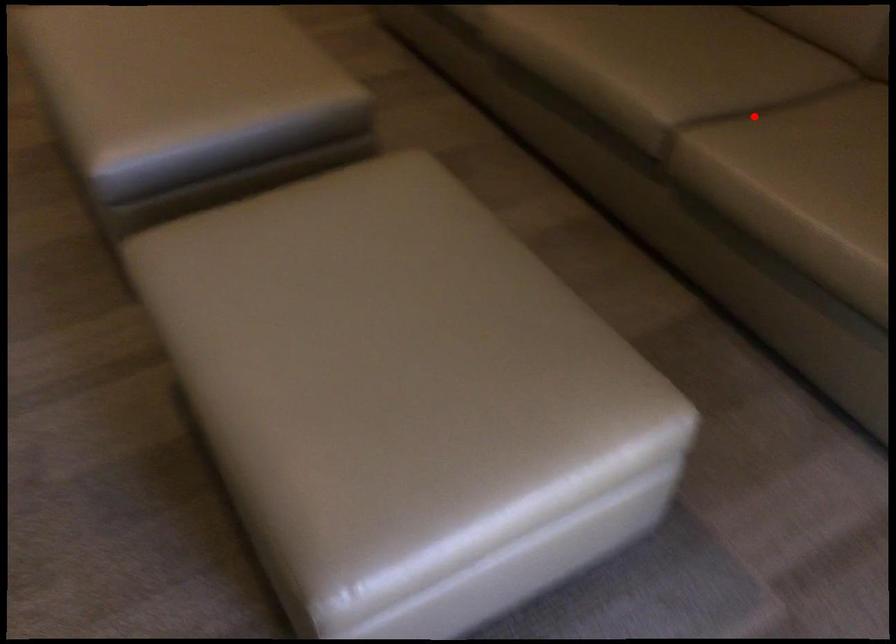
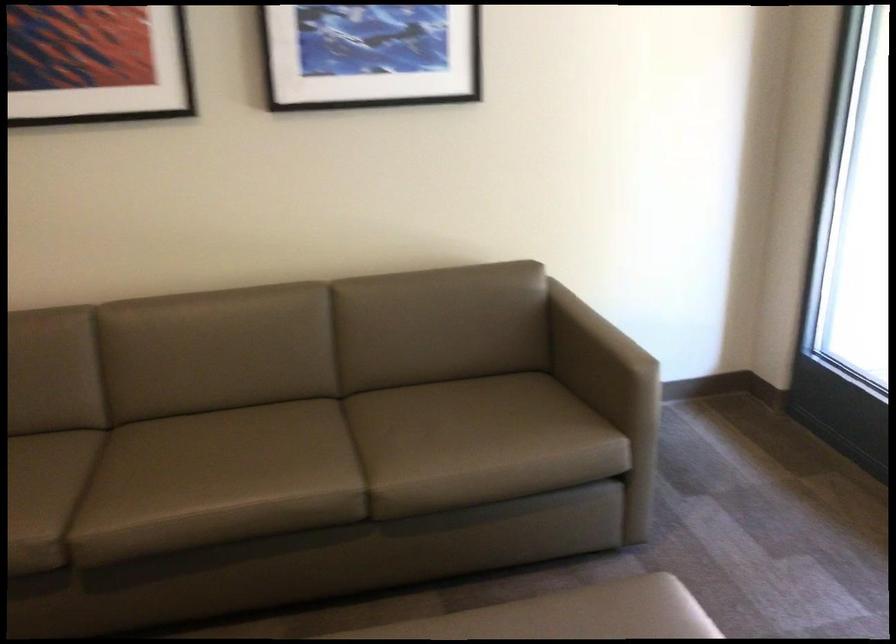
The point at the highlighted location is marked in the first image. Where is the corresponding point in the second image?

(356, 450)